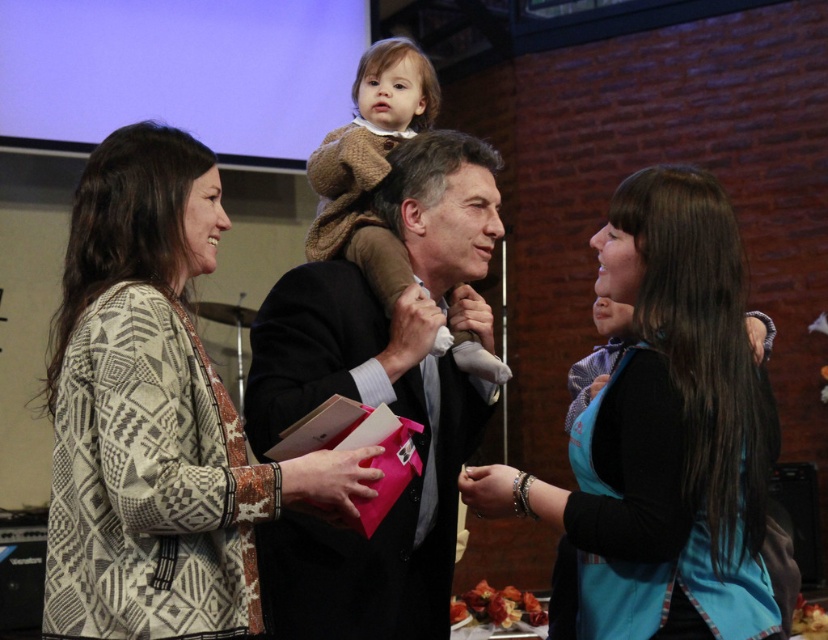
You are organizing a photo shoot and need to arrange two outfits on a mannequin stand. The stand can only hold items that are the same width. You have the dark suit at center and the brown knitted sweater at center. Based on the scene description, can both outfits be placed on the same stand?

The dark suit at center might be wider than brown knitted sweater at center, so they may not have the same width. Therefore, it is uncertain if both outfits can be placed on the same stand.

You are attending a formal event and need to find the dark suit at center and the brown knitted sweater at center. According to the scene, which one is located to the right of the other?

The dark suit at center is positioned on the right side of brown knitted sweater at center, so the dark suit at center is to the right of the brown knitted sweater at center.

You are a photographer setting up for a group photo. You notice the patterned knit sweater at left and the dark suit at center. Which object is closer to the camera?

The patterned knit sweater at left is closer to the camera because it is in front of the dark suit at center.